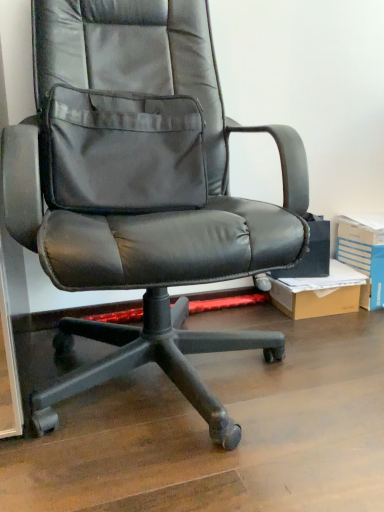
Question: Does black leather office chair at center appear on the right side of blue cardboard box at right?

Choices:
 (A) yes
 (B) no

Answer: (B)

Question: Considering the relative sizes of black leather office chair at center and blue cardboard box at right in the image provided, is black leather office chair at center wider than blue cardboard box at right?

Choices:
 (A) no
 (B) yes

Answer: (B)

Question: Is black leather office chair at center positioned far away from blue cardboard box at right?

Choices:
 (A) no
 (B) yes

Answer: (A)

Question: Can we say black leather office chair at center lies outside blue cardboard box at right?

Choices:
 (A) yes
 (B) no

Answer: (A)

Question: Is black leather office chair at center behind blue cardboard box at right?

Choices:
 (A) no
 (B) yes

Answer: (A)

Question: From the image's perspective, relative to black leather office chair at center, is blue cardboard box at right above or below?

Choices:
 (A) above
 (B) below

Answer: (B)

Question: Is blue cardboard box at right spatially inside black leather office chair at center, or outside of it?

Choices:
 (A) inside
 (B) outside

Answer: (B)

Question: From their relative heights in the image, would you say blue cardboard box at right is taller or shorter than black leather office chair at center?

Choices:
 (A) tall
 (B) short

Answer: (B)

Question: From a real-world perspective, relative to black leather office chair at center, is blue cardboard box at right vertically above or below?

Choices:
 (A) below
 (B) above

Answer: (A)

Question: In terms of height, does brown cardboard box at lower right look taller or shorter compared to blue cardboard box at right?

Choices:
 (A) short
 (B) tall

Answer: (A)

Question: Is point (317, 291) positioned closer to the camera than point (360, 303)?

Choices:
 (A) closer
 (B) farther

Answer: (A)

Question: From the image's perspective, is brown cardboard box at lower right positioned above or below blue cardboard box at right?

Choices:
 (A) above
 (B) below

Answer: (B)

Question: Is brown cardboard box at lower right in front of or behind blue cardboard box at right in the image?

Choices:
 (A) behind
 (B) front

Answer: (B)

Question: Relative to brown cardboard box at lower right, is blue cardboard box at right in front or behind?

Choices:
 (A) behind
 (B) front

Answer: (A)

Question: From the image's perspective, is blue cardboard box at right positioned above or below brown cardboard box at lower right?

Choices:
 (A) below
 (B) above

Answer: (B)